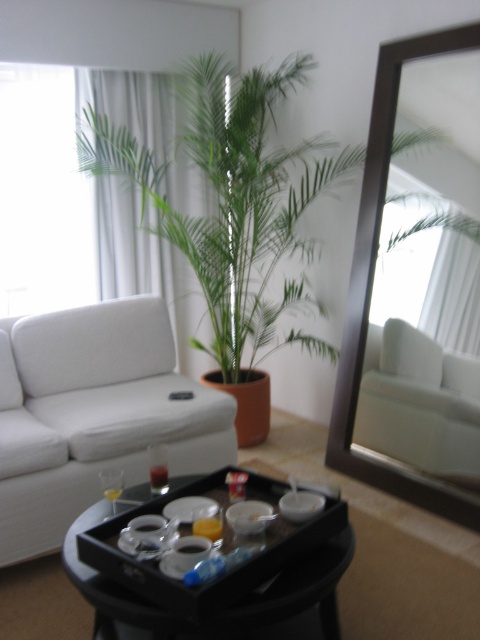
You are moving a rectangular box that is 1.2 meters wide into this living room. You need to place it either next to the brown wooden mirror at upper right or on the translucent glass tray at center. Which location can fit the box based on their widths?

The translucent glass tray at center has a greater width than the brown wooden mirror at upper right. Since the box is 1.2 meters wide, it can only be placed on the translucent glass tray at center if its width is at least 1.2 meters. However, since the mirror is narrower, it cannot accommodate the box. Please check the tray dimensions.